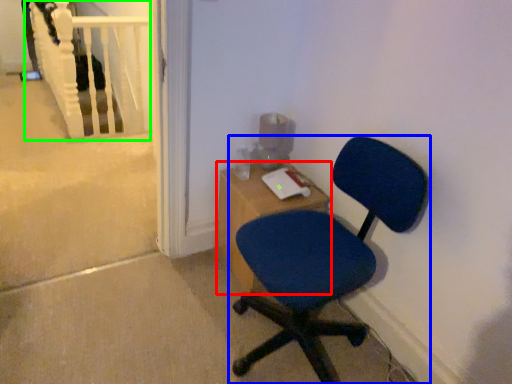
Question: Considering the real-world distances, which object is farthest from desk (highlighted by a red box)? chair (highlighted by a blue box) or rail (highlighted by a green box)?

Choices:
 (A) chair
 (B) rail

Answer: (B)